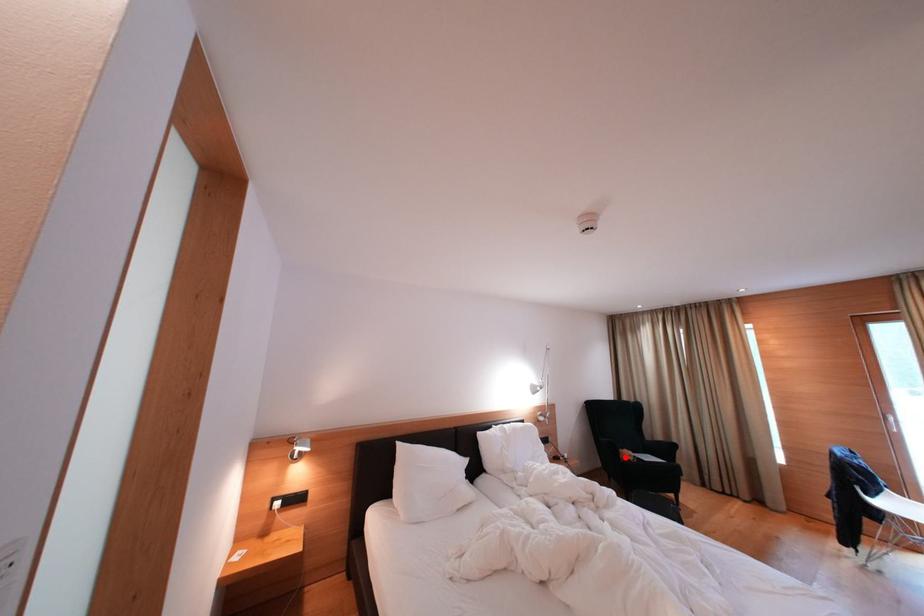
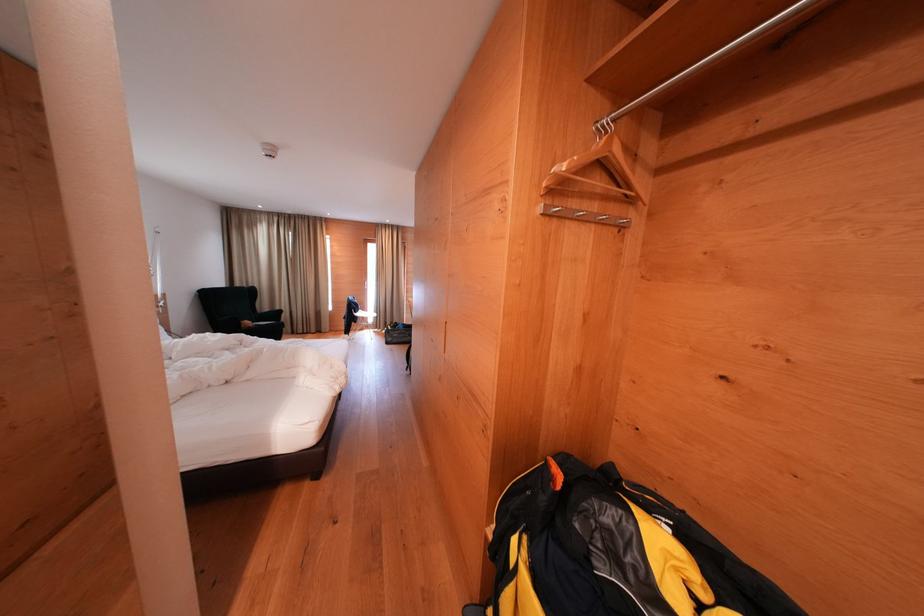
The point at the highlighted location is marked in the first image. Where is the corresponding point in the second image?

(247, 329)